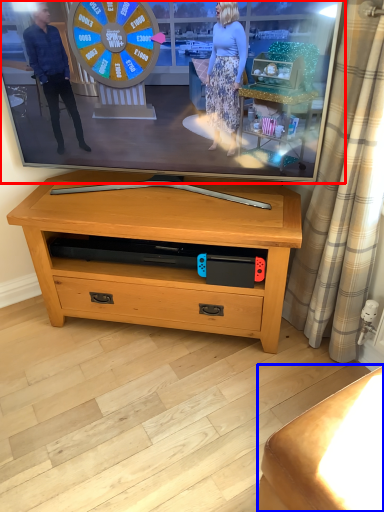
Question: Which of the following is the closest to the observer, television (highlighted by a red box) or furniture (highlighted by a blue box)?

Choices:
 (A) television
 (B) furniture

Answer: (B)